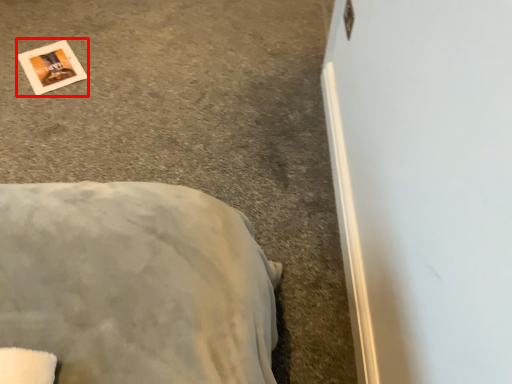
Question: Where is postcard (annotated by the red box) located in relation to concrete in the image?

Choices:
 (A) left
 (B) right

Answer: (A)